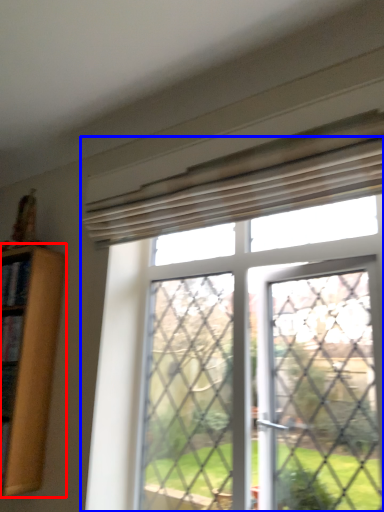
Question: Which object is closer to the camera taking this photo, shelf (highlighted by a red box) or window (highlighted by a blue box)?

Choices:
 (A) shelf
 (B) window

Answer: (B)